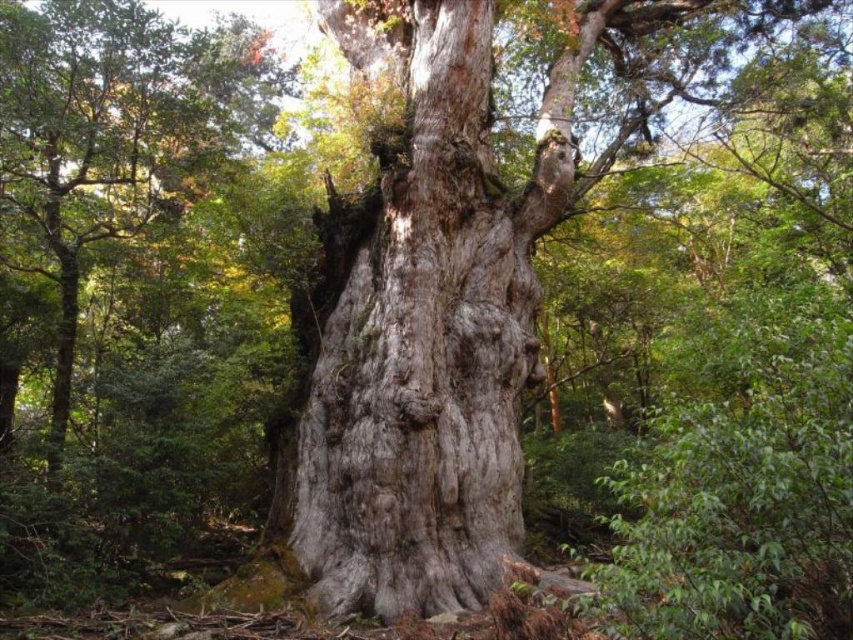
Question: Is gray rough bark tree trunk at center smaller than gray rough bark tree at center?

Choices:
 (A) no
 (B) yes

Answer: (A)

Question: Which of the following is the farthest from the observer?

Choices:
 (A) gray rough bark tree at center
 (B) gray rough bark tree trunk at center

Answer: (B)

Question: Among these points, which one is nearest to the camera?

Choices:
 (A) (167, 164)
 (B) (500, 307)

Answer: (B)

Question: Which of the following is the closest to the observer?

Choices:
 (A) (444, 406)
 (B) (65, 339)

Answer: (A)

Question: Where is gray rough bark tree trunk at center located in relation to gray rough bark tree at center in the image?

Choices:
 (A) left
 (B) right

Answer: (B)

Question: Does gray rough bark tree trunk at center have a greater width compared to gray rough bark tree at center?

Choices:
 (A) no
 (B) yes

Answer: (B)